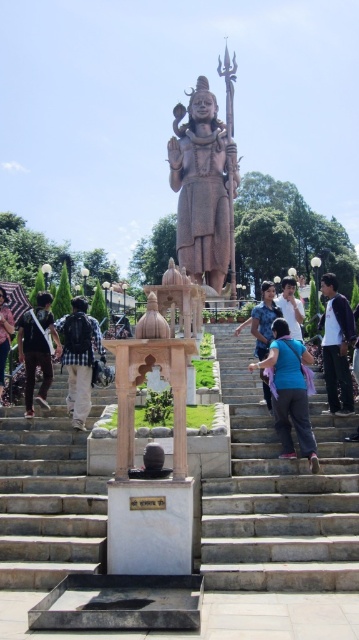
Question: Is blue fabric at center positioned in front of checkered fabric backpack at center?

Choices:
 (A) no
 (B) yes

Answer: (B)

Question: Which of the following is the farthest from the observer?

Choices:
 (A) white marble stairs at center
 (B) dark blue backpack at center
 (C) light blue shirt at center
 (D) blue fabric at center

Answer: (C)

Question: Which of the following is the farthest from the observer?

Choices:
 (A) (266, 326)
 (B) (29, 314)

Answer: (A)

Question: Does dark blue backpack at center appear on the right side of blue fabric shirt at center?

Choices:
 (A) no
 (B) yes

Answer: (A)

Question: Which point appears farthest from the camera in this image?

Choices:
 (A) (238, 369)
 (B) (75, 349)
 (C) (28, 326)
 (D) (308, 360)

Answer: (A)

Question: Does bronze statue at center have a smaller size compared to black jacket at right?

Choices:
 (A) no
 (B) yes

Answer: (A)